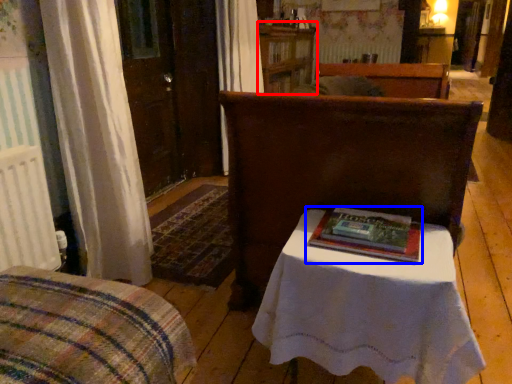
Question: Which of the following is the closest to the observer, dresser (highlighted by a red box) or book (highlighted by a blue box)?

Choices:
 (A) dresser
 (B) book

Answer: (B)